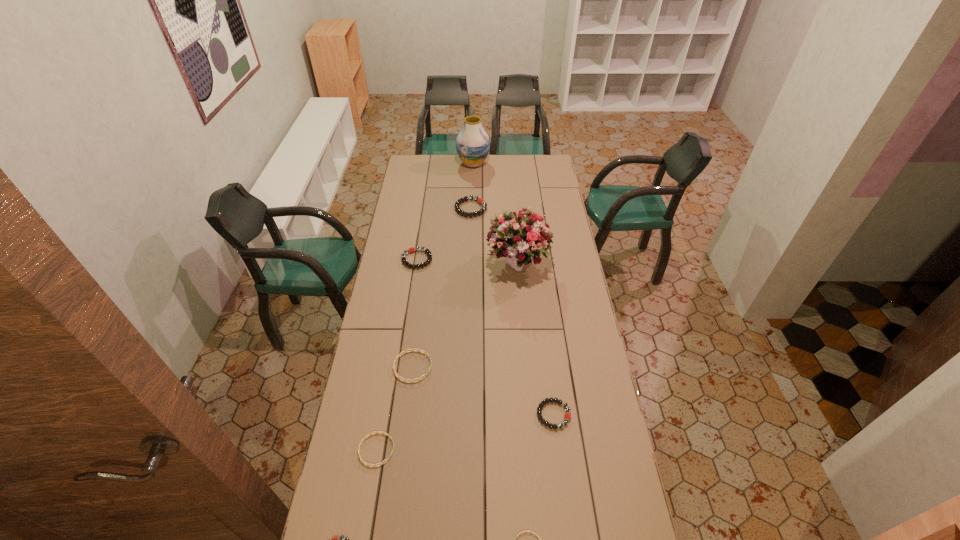
Where is `bouquet present at the right edge`? Image resolution: width=960 pixels, height=540 pixels. bouquet present at the right edge is located at coordinates (514, 236).

The height and width of the screenshot is (540, 960). I want to click on bracelet present at the right edge, so click(x=567, y=416).

The height and width of the screenshot is (540, 960). I want to click on vacant space at the far edge of the desktop, so click(526, 159).

Where is `blank space at the left edge`? blank space at the left edge is located at coordinates point(390,346).

At what (x,y) coordinates should I click in order to perform the action: click on free spot between the bouquet and the third smallest black bracelet. Please return your answer as a coordinate pair (x, y). Looking at the image, I should click on (468, 261).

You are a GUI agent. You are given a task and a screenshot of the screen. Output one action in this format:
    pyautogui.click(x=<x>, y=<y>)
    Task: Click on the free space between the fifth bracelet from left to right and the biggest blue bracelet
    The width and height of the screenshot is (960, 540).
    Given the screenshot: What is the action you would take?
    pyautogui.click(x=442, y=287)

In order to click on vacant area that lies between the second nearest black bracelet and the second nearest blue bracelet in this screenshot , I will do `click(465, 432)`.

Where is `empty location between the biggest black bracelet and the second smallest blue bracelet`? The image size is (960, 540). empty location between the biggest black bracelet and the second smallest blue bracelet is located at coordinates point(423,329).

Image resolution: width=960 pixels, height=540 pixels. I want to click on unoccupied area between the vase and the bouquet, so click(x=495, y=214).

The width and height of the screenshot is (960, 540). I want to click on vacant area that lies between the farthest blue bracelet and the third smallest black bracelet, so click(415, 313).